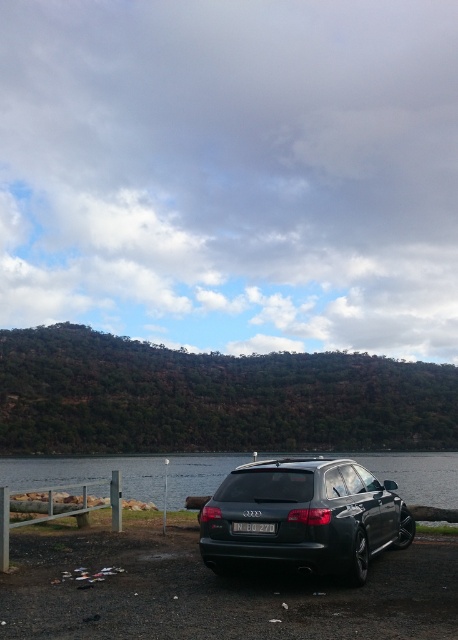
You are standing near the dark Audi car parked on the gravelly area and want to find the clear water at lower center. According to the coordinates provided, where should you look relative to the car?

The clear water at lower center is located at coordinates point (87, 474), so you should look towards the lower center direction relative to your position near the car.

You are standing at the parking area near the dark Audi station wagon. You see two points marked on the ground, one at coordinates point (218, 536) and the other at point (239, 524). Which point is closer to the car?

Point (218, 536) is behind point (239, 524), so the point closer to the car is point (239, 524).